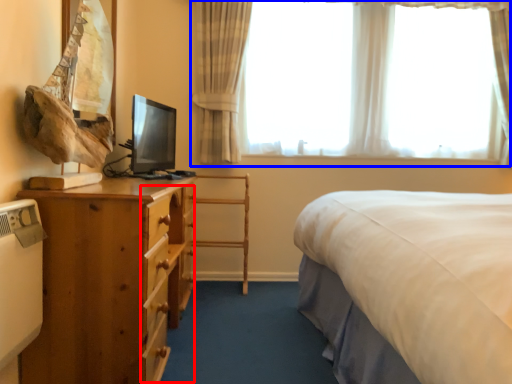
Question: Which point is closer to the camera, drawer (highlighted by a red box) or window (highlighted by a blue box)?

Choices:
 (A) drawer
 (B) window

Answer: (A)